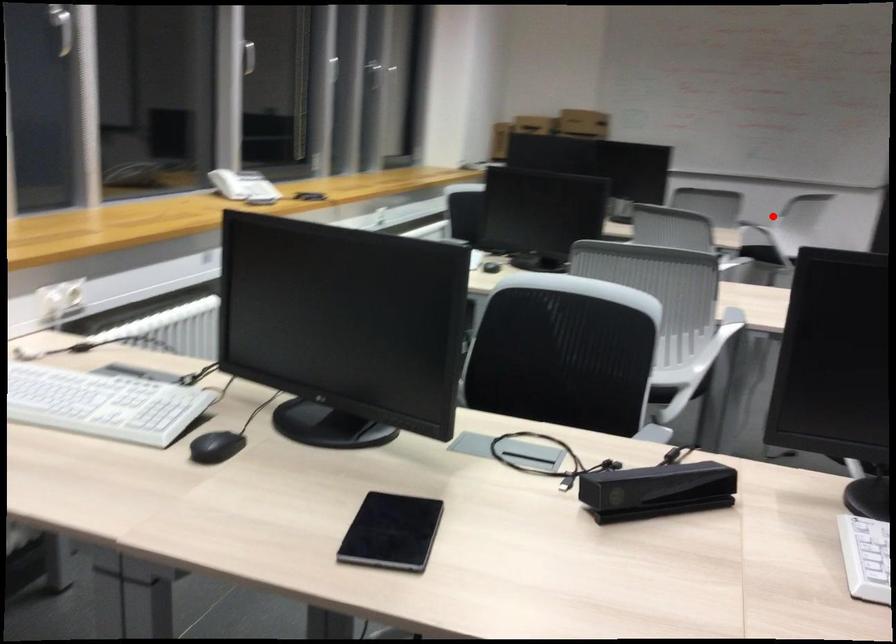
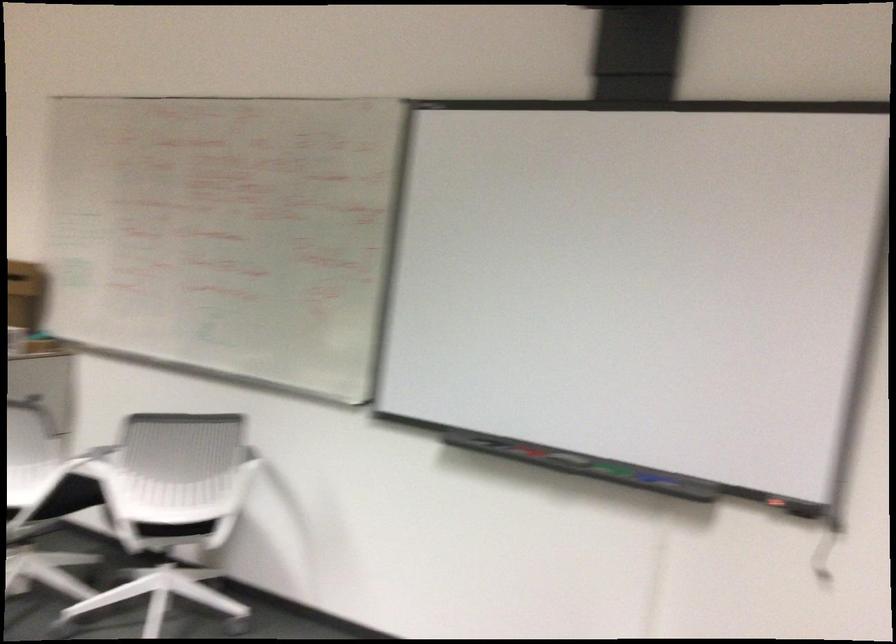
Where in the second image is the point corresponding to the highlighted location from the first image?

(95, 460)